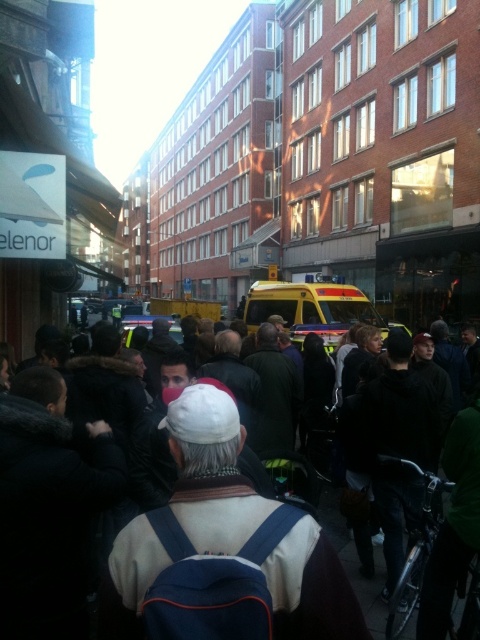
From the picture: You are a pedestrian trying to cross the street in the scene. You see the white knitted hat at center and the yellow rubber taxi at center. Which object is closer to the ground?

The white knitted hat at center is located below the yellow rubber taxi at center, so the white knitted hat at center is closer to the ground.

You are a photographer standing at the center of the street. You want to take a picture of the white knitted hat at center. Where should you aim your camera to capture it in the frame?

You should aim your camera at point 0.739 on the x axis and 0.442 on the y axis to capture the white knitted hat at center in the frame.